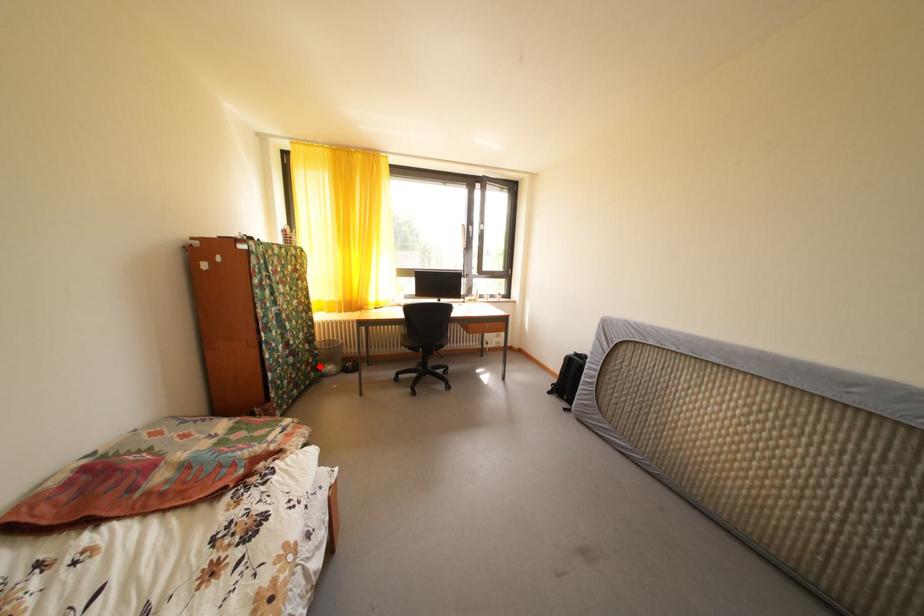
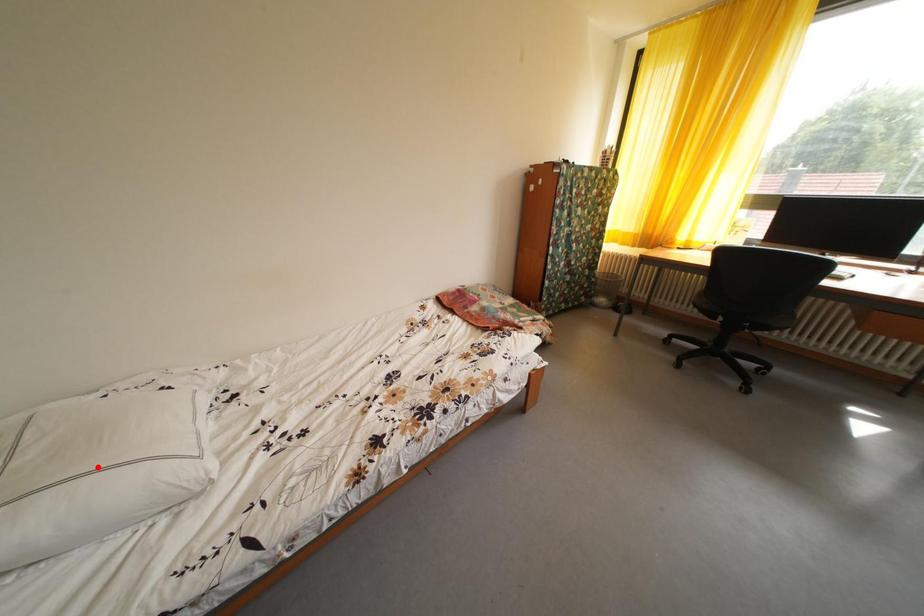
I am providing you with two images of the same scene from different viewpoints. A red point is marked on the first image and another point is marked on the second image. Is the red point in image1 aligned with the point shown in image2?

No